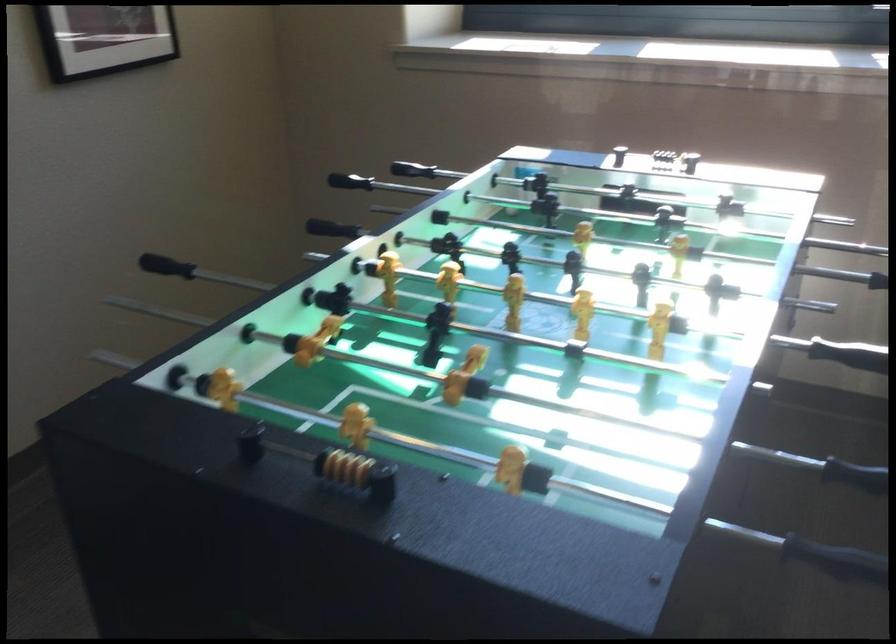
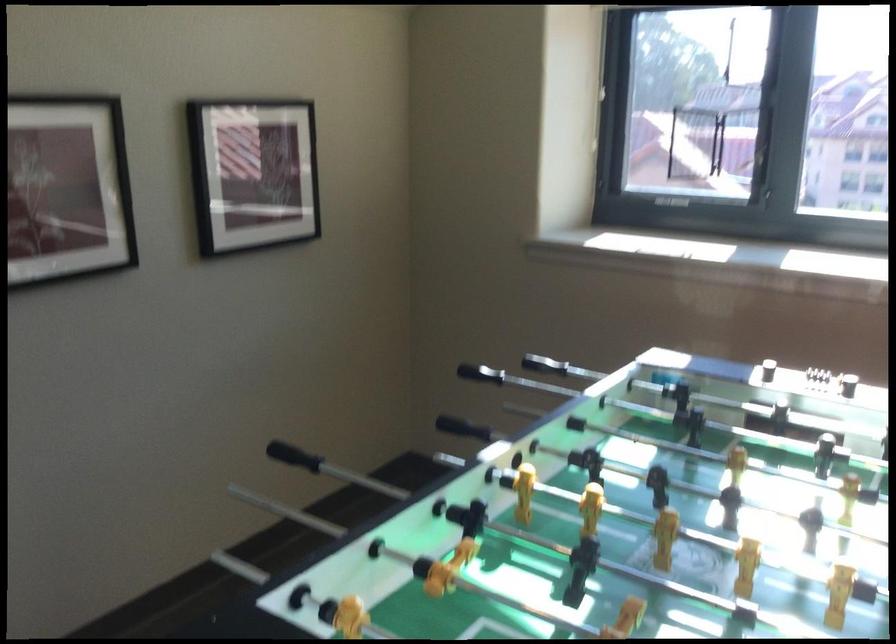
Locate, in the second image, the point that corresponds to point (358, 190) in the first image.

(479, 373)